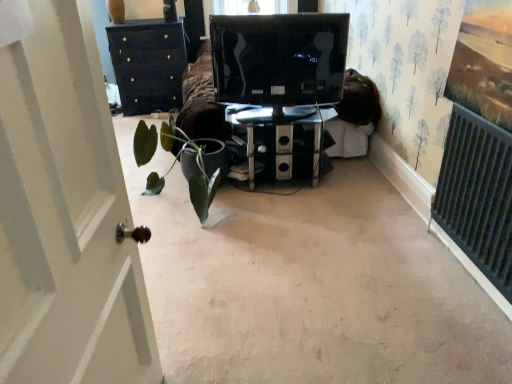
Question: From the image's perspective, would you say black glossy monitor at center is positioned over green matte plant at center?

Choices:
 (A) yes
 (B) no

Answer: (A)

Question: Are black glossy monitor at center and green matte plant at center beside each other?

Choices:
 (A) no
 (B) yes

Answer: (A)

Question: Is black glossy monitor at center thinner than green matte plant at center?

Choices:
 (A) yes
 (B) no

Answer: (A)

Question: Are black glossy monitor at center and green matte plant at center located far from each other?

Choices:
 (A) no
 (B) yes

Answer: (A)

Question: Does black glossy monitor at center have a lesser height compared to green matte plant at center?

Choices:
 (A) no
 (B) yes

Answer: (A)

Question: From their relative heights in the image, would you say transparent glass table at center is taller or shorter than green matte plant at center?

Choices:
 (A) tall
 (B) short

Answer: (B)

Question: Would you say transparent glass table at center is inside or outside green matte plant at center?

Choices:
 (A) outside
 (B) inside

Answer: (A)

Question: Is point (248, 120) positioned closer to the camera than point (147, 175)?

Choices:
 (A) farther
 (B) closer

Answer: (B)

Question: Is transparent glass table at center in front of or behind green matte plant at center in the image?

Choices:
 (A) behind
 (B) front

Answer: (A)

Question: From the image's perspective, relative to transparent glass table at center, is green matte plant at center above or below?

Choices:
 (A) above
 (B) below

Answer: (B)

Question: Considering the positions of green matte plant at center and transparent glass table at center in the image, is green matte plant at center taller or shorter than transparent glass table at center?

Choices:
 (A) short
 (B) tall

Answer: (B)

Question: Is green matte plant at center inside the boundaries of transparent glass table at center, or outside?

Choices:
 (A) outside
 (B) inside

Answer: (A)

Question: Relative to transparent glass table at center, is green matte plant at center in front or behind?

Choices:
 (A) behind
 (B) front

Answer: (B)

Question: From the image's perspective, relative to black glossy monitor at center, is transparent glass table at center above or below?

Choices:
 (A) above
 (B) below

Answer: (B)

Question: Is transparent glass table at center spatially inside black glossy monitor at center, or outside of it?

Choices:
 (A) inside
 (B) outside

Answer: (B)